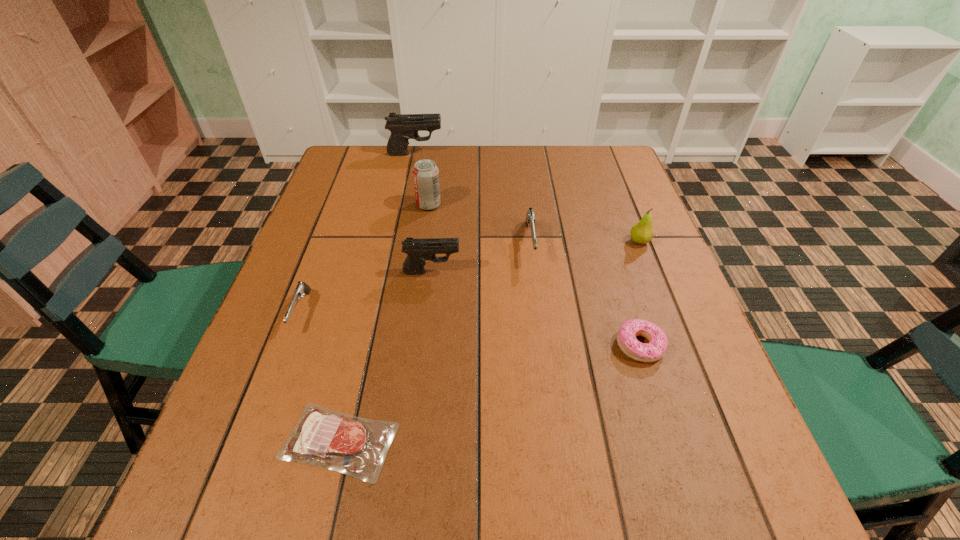
The image size is (960, 540). I want to click on blank space that satisfies the following two spatial constraints: 1. at the barrel of the farther black pistol; 2. on the left side of the pink doughnut, so click(x=376, y=346).

This screenshot has height=540, width=960. I want to click on vacant space that satisfies the following two spatial constraints: 1. on the back side of the steak; 2. on the right side of the seventh nearest object, so click(x=395, y=205).

The width and height of the screenshot is (960, 540). Identify the location of vacant space that satisfies the following two spatial constraints: 1. at the barrel of the bigger black pistol; 2. on the front side of the shortest object. (356, 442).

The width and height of the screenshot is (960, 540). I want to click on free space that satisfies the following two spatial constraints: 1. at the barrel of the farthest pistol; 2. on the back side of the pear, so click(397, 241).

Locate an element on the screen. The height and width of the screenshot is (540, 960). blank space that satisfies the following two spatial constraints: 1. on the back side of the second object from right to left; 2. at the barrel of the third shortest pistol is located at coordinates (617, 272).

Locate an element on the screen. Image resolution: width=960 pixels, height=540 pixels. blank area in the image that satisfies the following two spatial constraints: 1. on the back side of the pink doughnut; 2. on the left side of the nearest object is located at coordinates (362, 346).

Find the location of `free region that satisfies the following two spatial constraints: 1. at the barrel of the tallest pistol; 2. on the front-facing side of the leftmost pistol`. free region that satisfies the following two spatial constraints: 1. at the barrel of the tallest pistol; 2. on the front-facing side of the leftmost pistol is located at coordinates (383, 312).

Identify the location of free location that satisfies the following two spatial constraints: 1. at the barrel of the tallest pistol; 2. on the right side of the seventh nearest object. The image size is (960, 540). (405, 205).